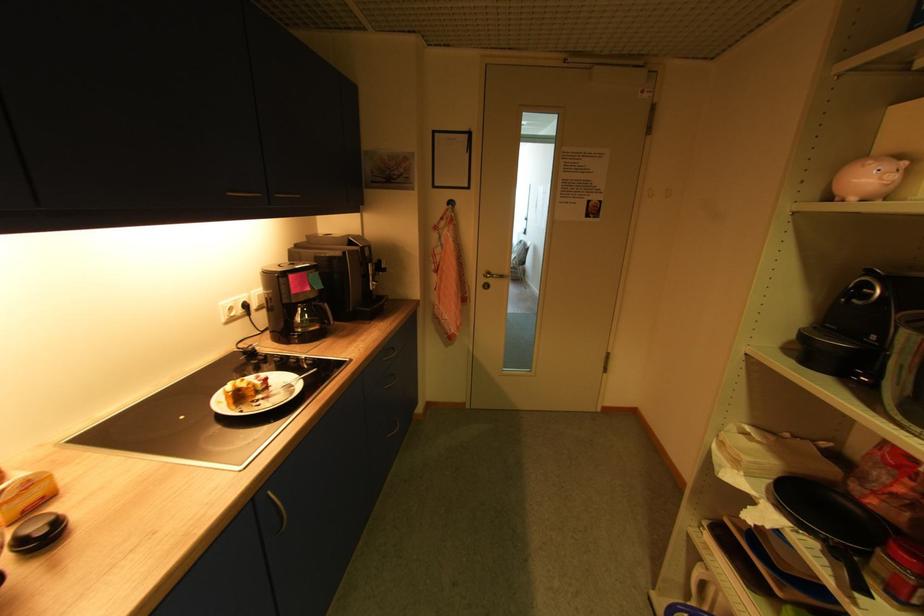
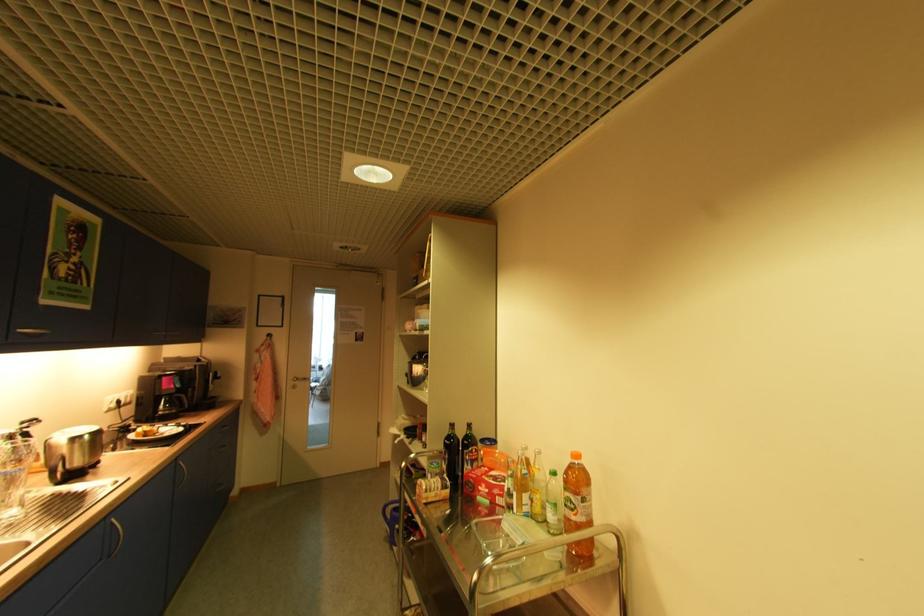
Question: I am providing you with two images of the same scene from different viewpoints. Please identify which objects are invisible in image2.

Choices:
 (A) red cardboard box
 (B) clear glass bottle
 (C) cart handle
 (D) none of these

Answer: (D)